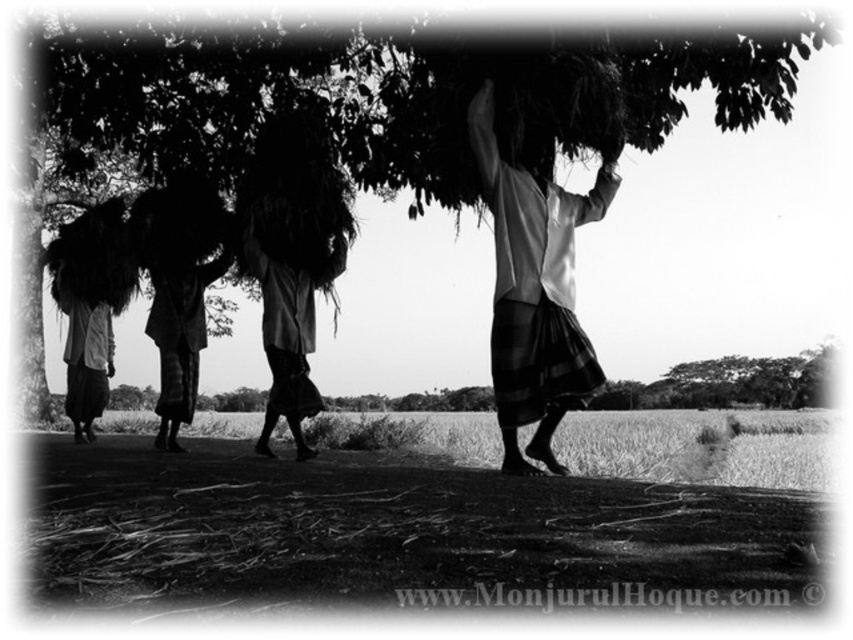
Identify the location of green leafy tree at upper center. This screenshot has height=640, width=853. (381, 99).

Is point (369, 156) positioned after point (312, 168)?

Yes, it is.

Identify the location of green leafy tree at upper center. (381, 99).

Is the position of white fabric basket at center more distant than that of dark fabric bundle at center?

No, white fabric basket at center is closer to the viewer.

Locate an element on the screen. The width and height of the screenshot is (853, 640). white fabric basket at center is located at coordinates (534, 292).

Which is more to the right, green leafy tree at upper center or white fabric basket at center?

From the viewer's perspective, white fabric basket at center appears more on the right side.

In the scene shown: Which of these two, green leafy tree at upper center or white fabric basket at center, stands taller?

green leafy tree at upper center is taller.

Find the location of a particular element. green leafy tree at upper center is located at coordinates (381, 99).